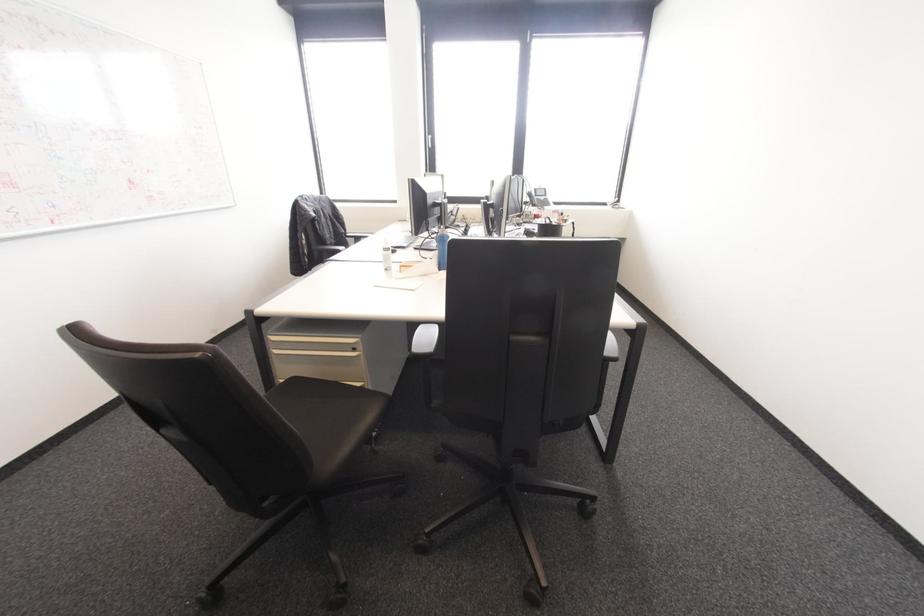
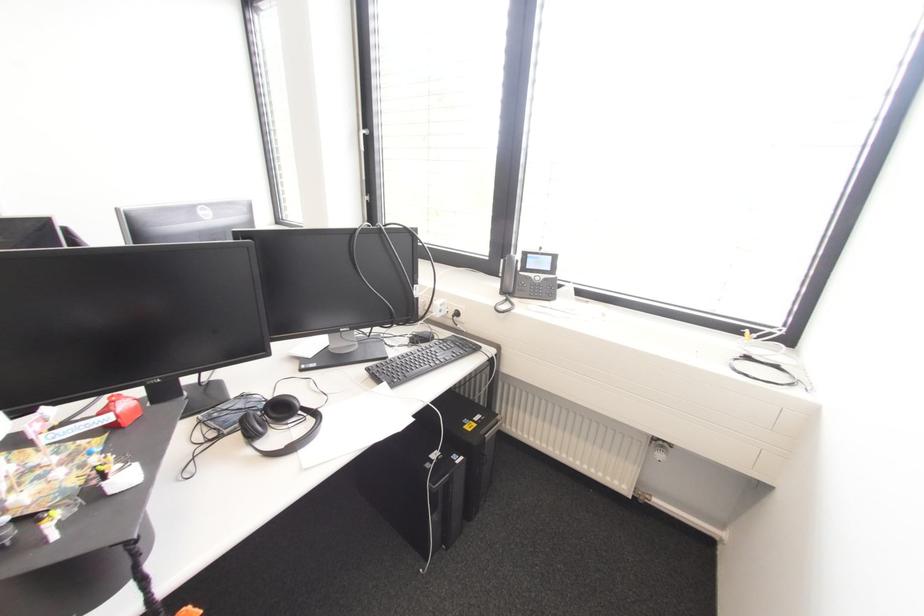
In the second image, find the point that corresponds to point 429,137 in the first image.

(361, 132)